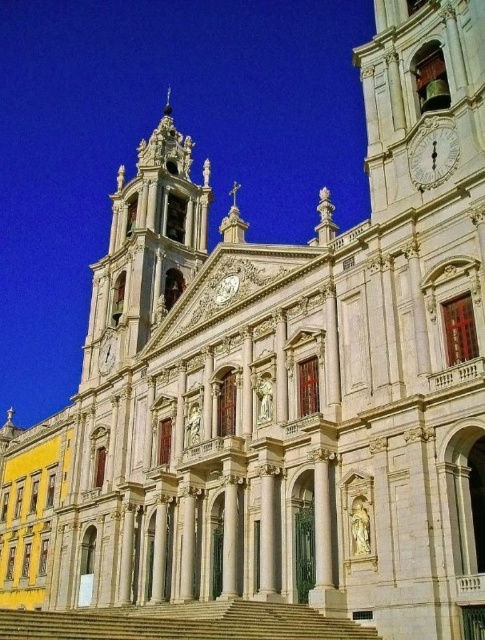
Is white marble clock at upper right behind white marble clock at center?

No, white marble clock at upper right is closer to the viewer.

Who is lower down, white marble clock at upper right or white marble clock at center?

white marble clock at center is below.

At what (x,y) coordinates should I click in order to perform the action: click on white marble clock at upper right. Please return your answer as a coordinate pair (x, y). The image size is (485, 640). Looking at the image, I should click on (434, 152).

Consider the image. Is gold ornate clock tower at upper left wider than white marble stairs at center?

Indeed, gold ornate clock tower at upper left has a greater width compared to white marble stairs at center.

Is gold ornate clock tower at upper left below white marble stairs at center?

Actually, gold ornate clock tower at upper left is above white marble stairs at center.

Is point (145, 320) positioned behind point (325, 634)?

Yes, point (145, 320) is farther from viewer.

This screenshot has width=485, height=640. Find the location of `gold ornate clock tower at upper left`. gold ornate clock tower at upper left is located at coordinates (146, 246).

Can you confirm if white marble stairs at center is bigger than white marble clock at upper right?

Yes, white marble stairs at center is bigger than white marble clock at upper right.

Who is higher up, white marble stairs at center or white marble clock at upper right?

white marble clock at upper right

Is point (275, 609) farther from viewer compared to point (447, 156)?

That is False.

You are a GUI agent. You are given a task and a screenshot of the screen. Output one action in this format:
    pyautogui.click(x=<x>, y=<y>)
    Task: Click on the white marble stairs at center
    
    Given the screenshot: What is the action you would take?
    pyautogui.click(x=182, y=621)